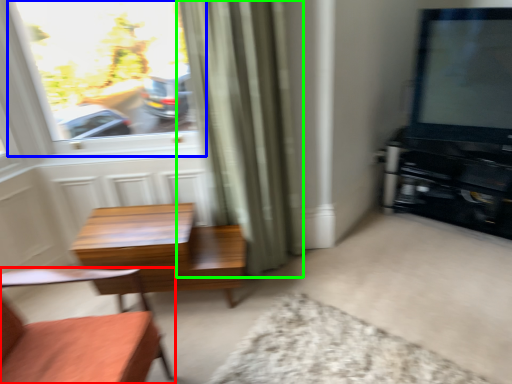
Question: Based on their relative distances, which object is nearer to chair (highlighted by a red box)? Choose from window (highlighted by a blue box) and curtain (highlighted by a green box).

Choices:
 (A) window
 (B) curtain

Answer: (B)